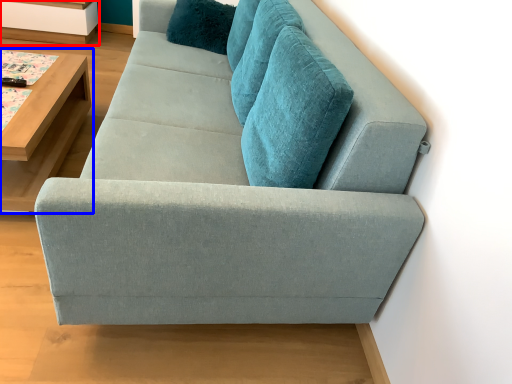
Question: Which object appears farthest to the camera in this image, shelf (highlighted by a red box) or table (highlighted by a blue box)?

Choices:
 (A) shelf
 (B) table

Answer: (A)